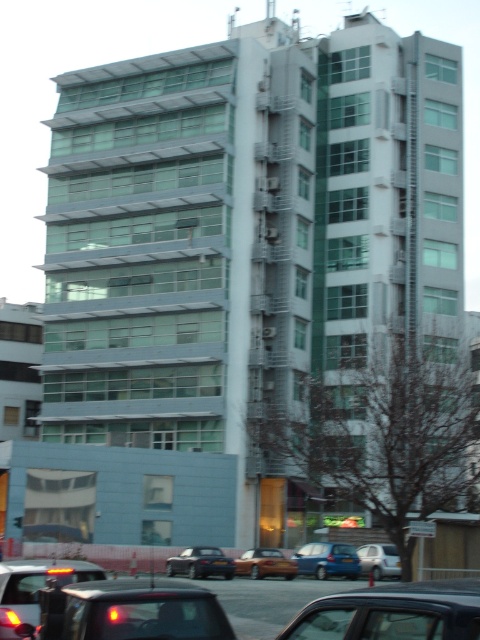
Question: Which of the following is the farthest from the observer?

Choices:
 (A) black plastic license plate at center
 (B) silver metallic sedan at center
 (C) metallic orange taxi at center

Answer: (C)

Question: Which point appears closest to the camera in this image?

Choices:
 (A) (135, 636)
 (B) (349, 561)
 (C) (217, 561)
 (D) (205, 547)

Answer: (A)

Question: Can you confirm if metallic orange taxi at center is smaller than silver metallic sedan at center?

Choices:
 (A) no
 (B) yes

Answer: (B)

Question: Does metallic orange taxi at center lie behind silver metallic sedan at center?

Choices:
 (A) no
 (B) yes

Answer: (B)

Question: Which point is closer to the camera?

Choices:
 (A) metallic blue sedan at center
 (B) black glossy car at lower left
 (C) shiny black sedan at center
 (D) metallic orange taxi at center

Answer: (B)

Question: Is black glossy car at lower center bigger than metallic orange taxi at center?

Choices:
 (A) no
 (B) yes

Answer: (B)